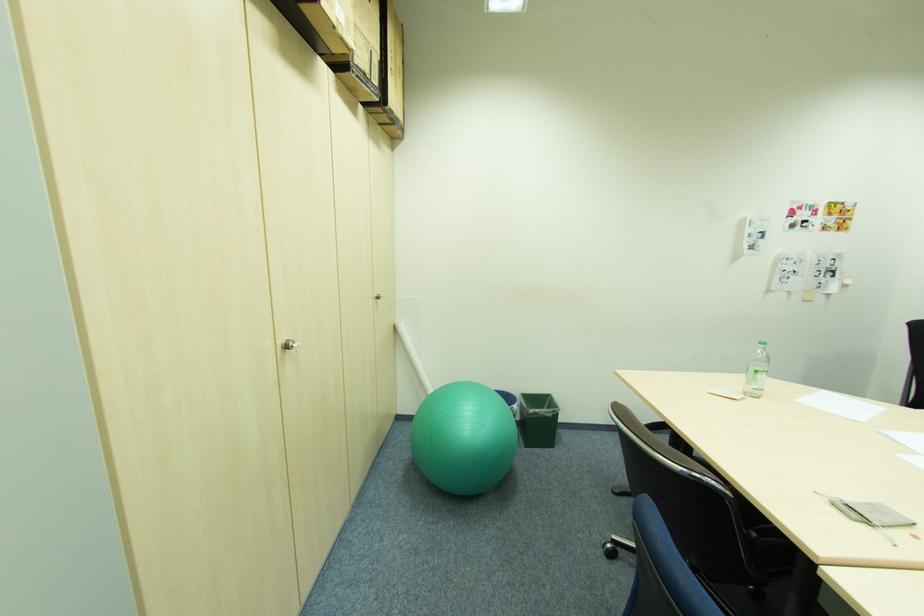
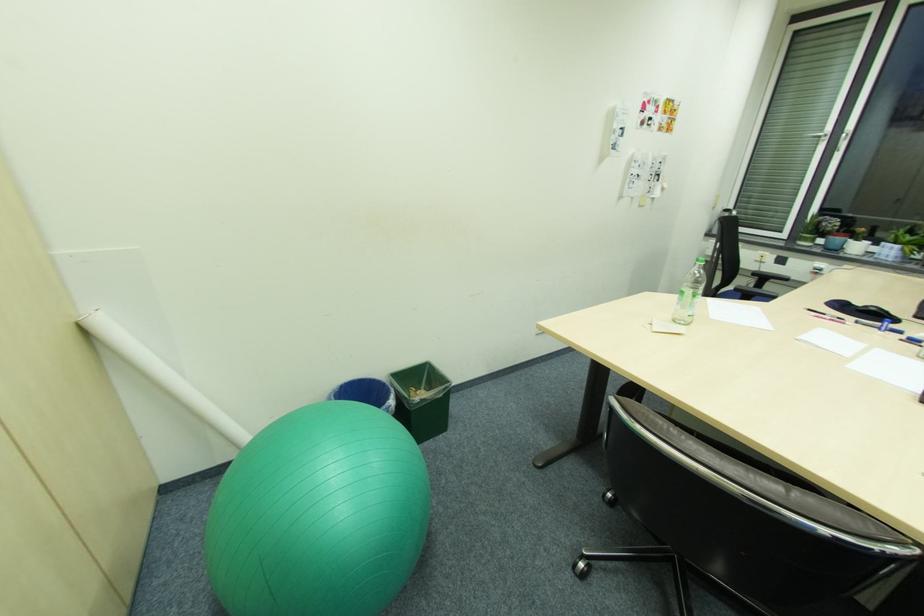
In the second image, find the point that corresponds to (398,323) in the first image.

(79, 321)